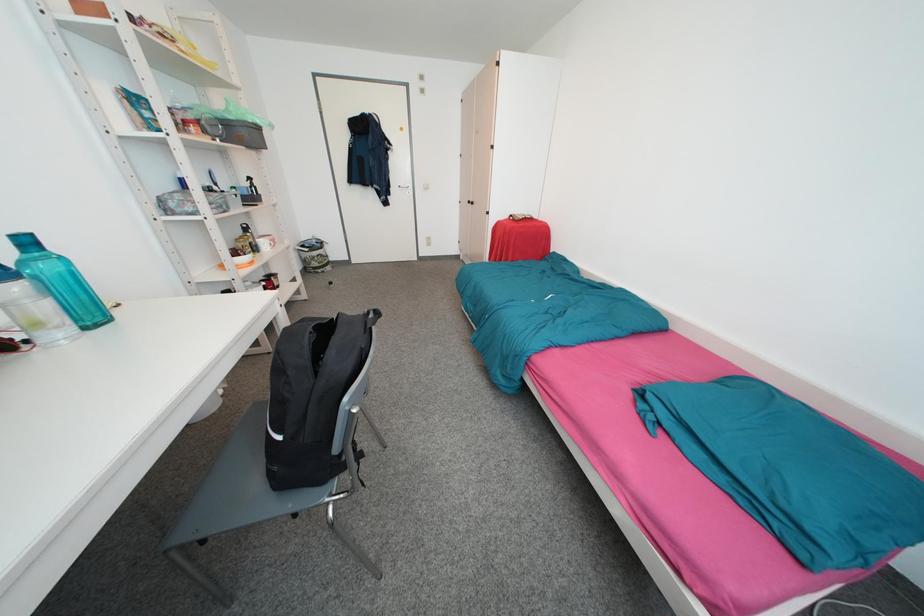
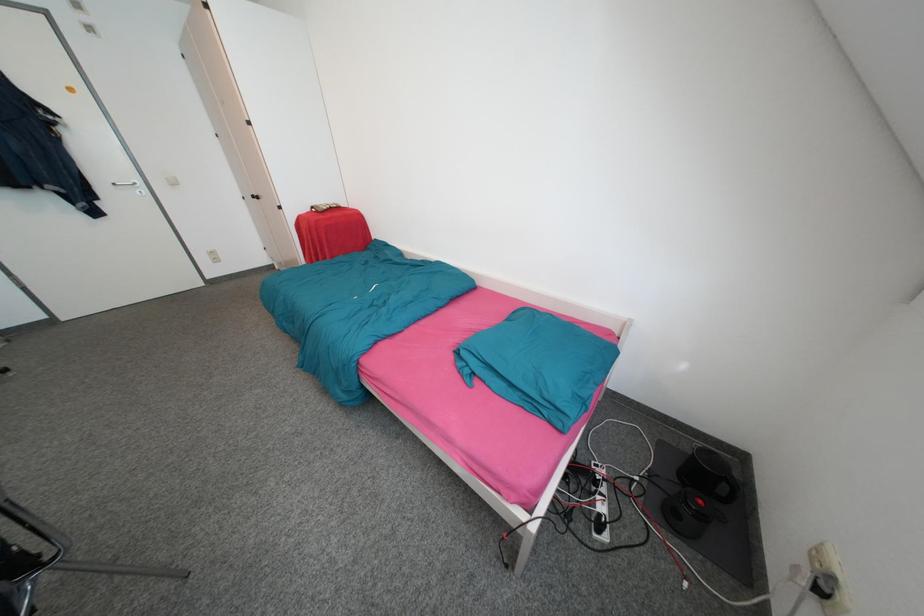
Question: The camera is either moving clockwise (left) or counter-clockwise (right) around the object. The first image is from the beginning of the video and the second image is from the end. Is the camera moving left or right when shooting the video?

Choices:
 (A) Left
 (B) Right

Answer: (A)